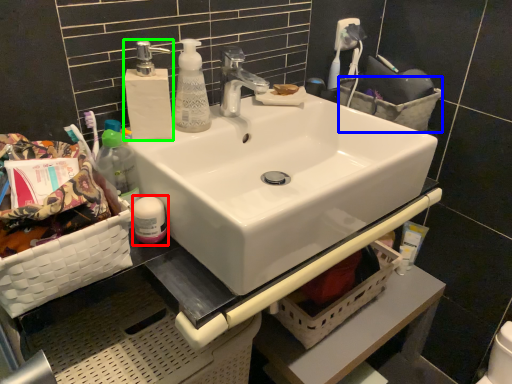
Question: Estimate the real-world distances between objects in this image. Which object is farther from toiletry (highlighted by a red box), basket (highlighted by a blue box) or soap dispenser (highlighted by a green box)?

Choices:
 (A) basket
 (B) soap dispenser

Answer: (A)